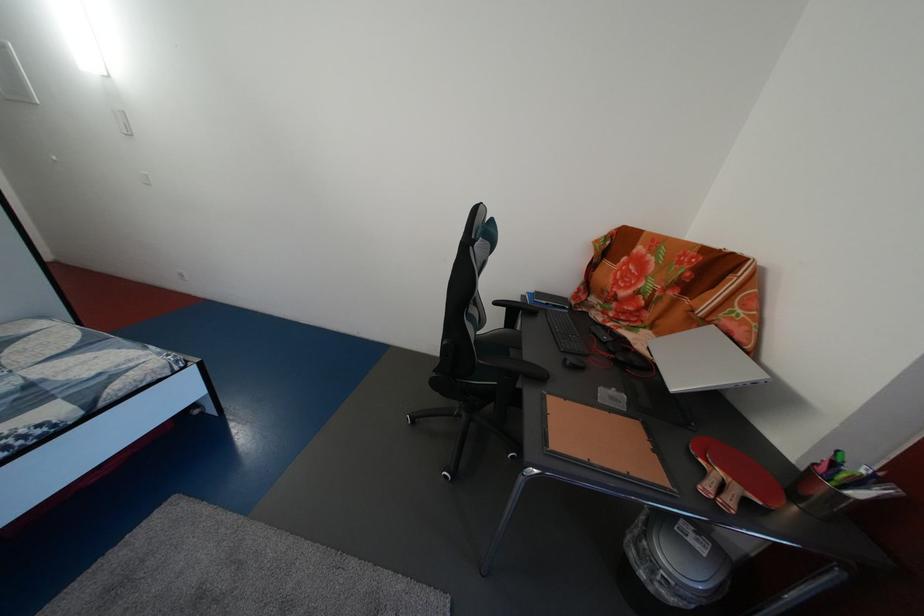
This screenshot has height=616, width=924. In order to click on black computer mouse in this screenshot , I will do `click(573, 362)`.